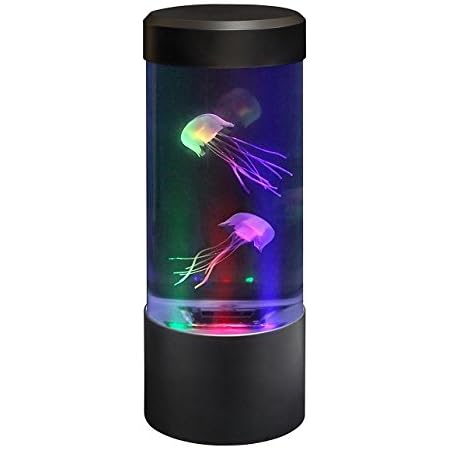
The width and height of the screenshot is (450, 450). Find the location of `blue color lights`. blue color lights is located at coordinates (166, 308).